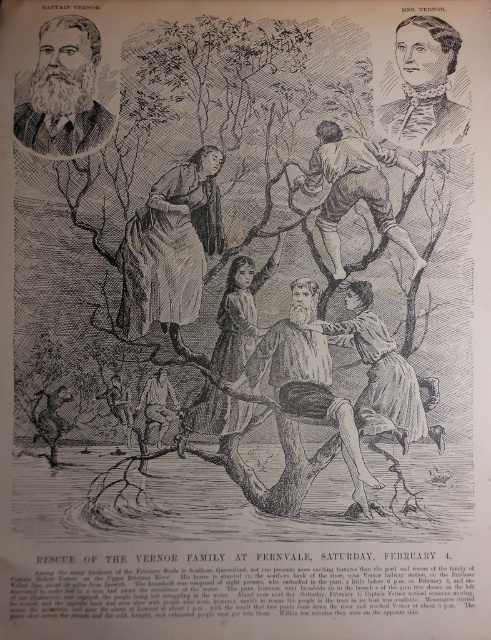
Between bearded man at upper left and smooth cream dress at upper right, which one is positioned higher?

smooth cream dress at upper right

Which is below, bearded man at upper left or smooth cream dress at upper right?

bearded man at upper left is lower down.

This screenshot has height=640, width=491. What do you see at coordinates (63, 90) in the screenshot? I see `bearded man at upper left` at bounding box center [63, 90].

Where is `bearded man at upper left`? The height and width of the screenshot is (640, 491). bearded man at upper left is located at coordinates (63, 90).

Is smooth brown skin at upper center shorter than smooth brown dress at center?

Correct, smooth brown skin at upper center is not as tall as smooth brown dress at center.

Who is more distant from viewer, (x=377, y=198) or (x=363, y=304)?

The point (x=377, y=198) is behind.

Which is behind, point (314, 150) or point (424, 428)?

Positioned behind is point (314, 150).

At what (x,y) coordinates should I click in order to perform the action: click on smooth brown skin at upper center. Please return your answer as a coordinate pair (x, y). This screenshot has height=640, width=491. Looking at the image, I should click on (354, 188).

Is bearded man at upper left to the left of smooth brown skin at upper center from the viewer's perspective?

Yes, bearded man at upper left is to the left of smooth brown skin at upper center.

In the scene shown: Measure the distance between bearded man at upper left and smooth brown skin at upper center.

17.97 inches

Identify the location of bearded man at upper left. Image resolution: width=491 pixels, height=640 pixels. (63, 90).